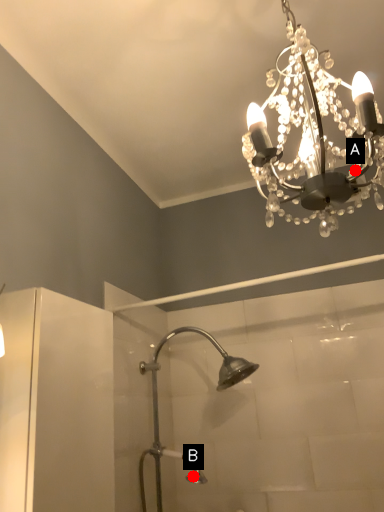
Question: Two points are circled on the image, labeled by A and B beside each circle. Which of the following is the farthest from the observer?

Choices:
 (A) A is further
 (B) B is further

Answer: (B)